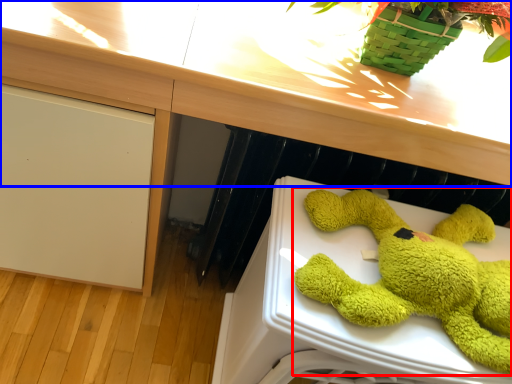
Question: Which point is closer to the camera, toy (highlighted by a red box) or counter top (highlighted by a blue box)?

Choices:
 (A) toy
 (B) counter top

Answer: (A)